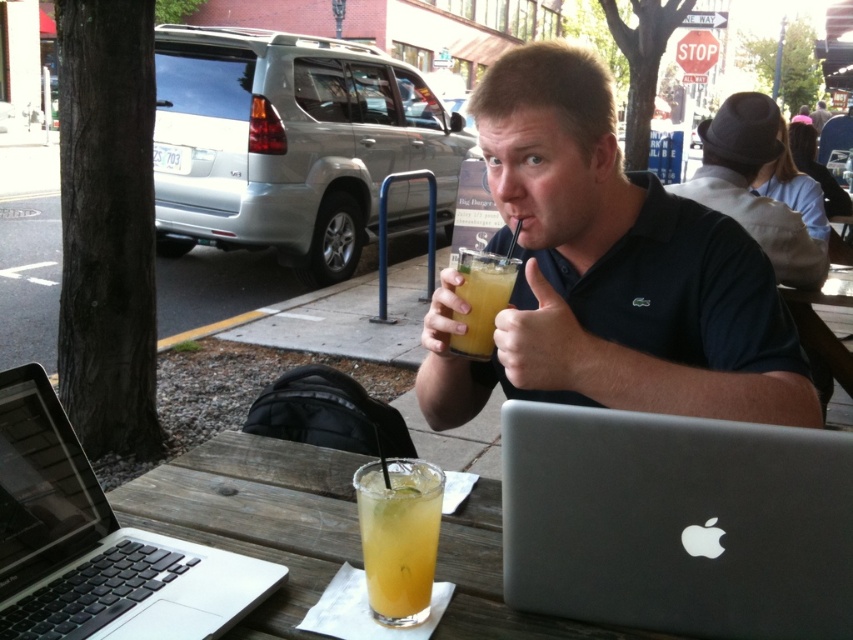
You are a photographer trying to capture the best angle of the scene. You notice two specific points in the image at coordinates point [750,563] and point [473,609]. Which point is closer to your camera lens?

Point [750,563] is closer to the camera lens than point [473,609].

You are a photographer setting up a tripod to take a photo of the silver metallic laptop at lower right and the wooden table at center. According to the scene, where should you position the tripod to capture both objects in the frame?

The silver metallic laptop at lower right is located above the wooden table at center, so position the tripod slightly above the wooden table at center to include both the silver metallic laptop at lower right and the wooden table at center in the frame.